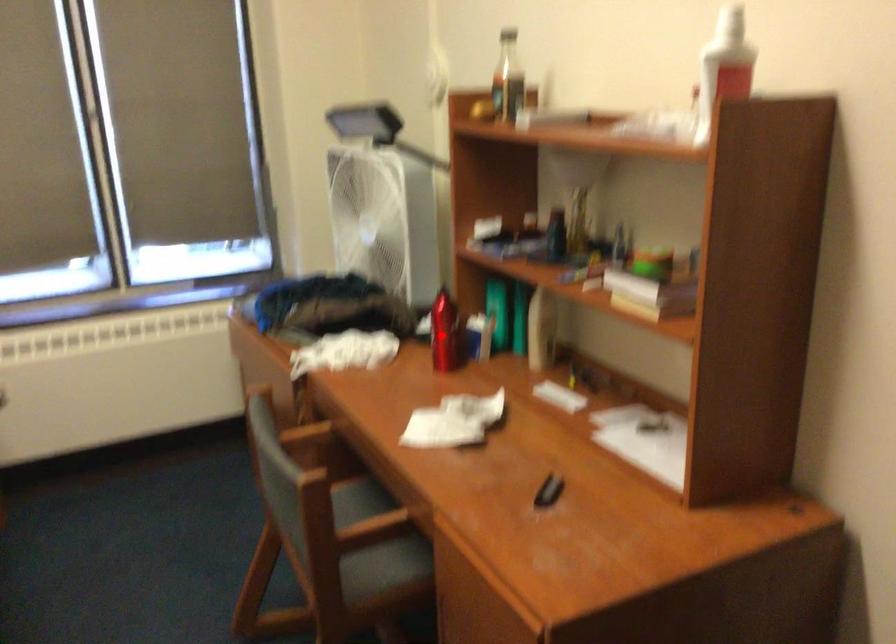
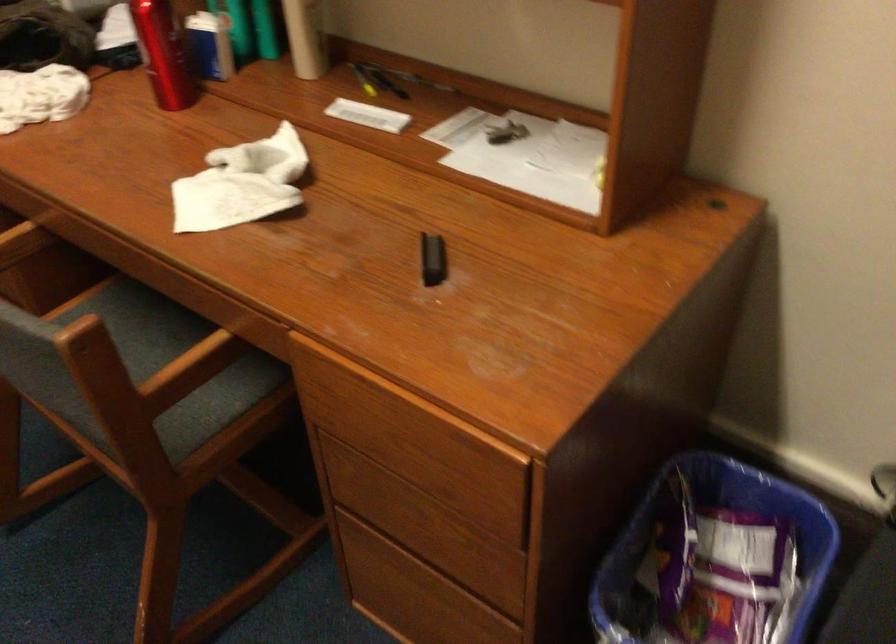
Question: I am providing you with two images of the same scene from different viewpoints. In image1, a red point is highlighted. Considering the same 3D point in image2, which of the following is correct?

Choices:
 (A) It is closer
 (B) It is farther

Answer: (A)